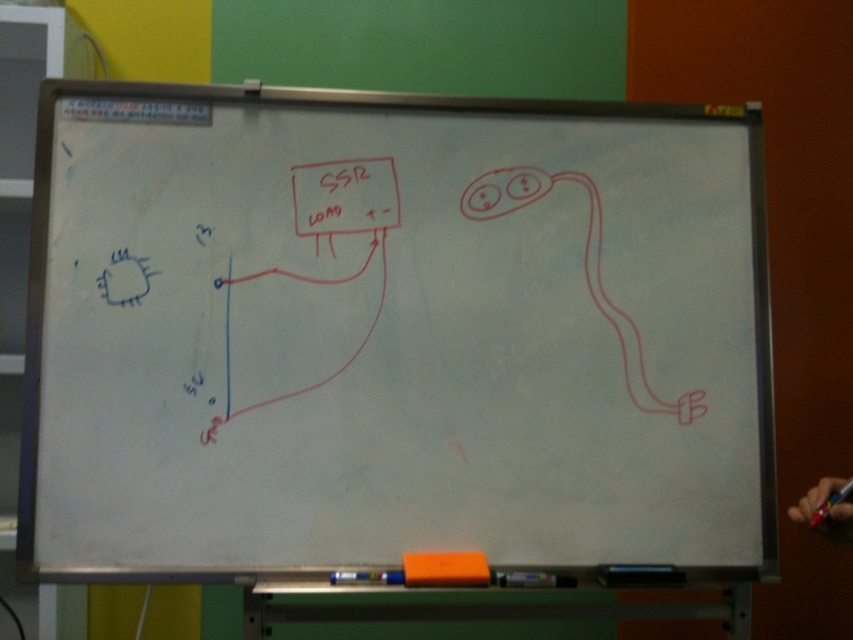
You are standing 1.5 meters away from the whiteboard. If you want to touch the point at coordinates point (x=634, y=480) on the whiteboard, will you be able to reach it without moving closer?

The distance of point (x=634, y=480) from the viewer is 1.60 meters. Since you are currently 1.5 meters away from the whiteboard, you are closer than the point, so you can reach it without moving closer.

You are standing in front of the whiteboard and want to reach both the white matte board at center and the black matte pen at lower center. Which object should you grab first if you want to pick up the one closer to you?

You should grab the white matte board at center first because it is closer to the viewer than the black matte pen at lower center.

Looking at this image, you are an artist holding a black matte pen at lower center and want to draw on the white matte board at center. Can you reach it without moving your hand? Please explain your reasoning.

The white matte board at center and black matte pen at lower center are 21.55 inches apart from each other. Since the average human arm length is significantly longer than 21.55 inches, you can likely reach the white matte board at center with your current position.